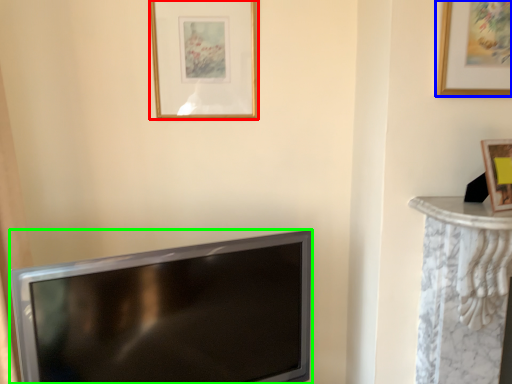
Question: Estimate the real-world distances between objects in this image. Which object is farther from picture frame (highlighted by a red box), picture frame (highlighted by a blue box) or television (highlighted by a green box)?

Choices:
 (A) picture frame
 (B) television

Answer: (A)